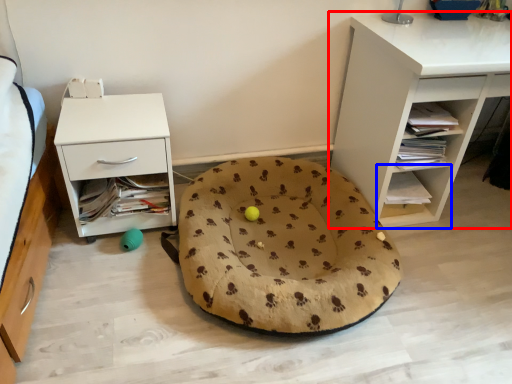
Question: Which object is further to the camera taking this photo, shelf (highlighted by a red box) or shelf (highlighted by a blue box)?

Choices:
 (A) shelf
 (B) shelf

Answer: (B)